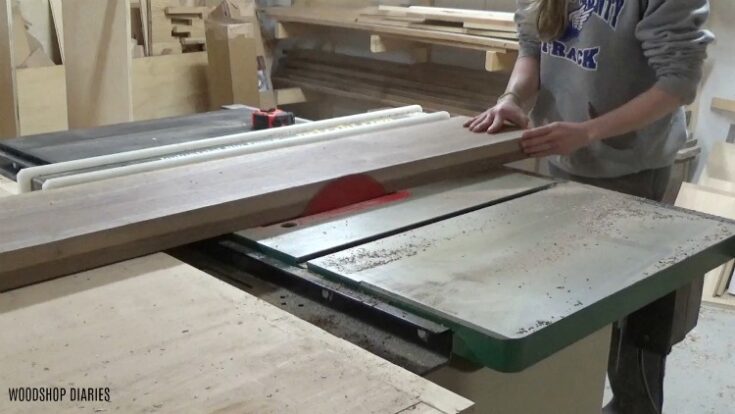
This screenshot has width=735, height=414. In order to click on wood plank in this screenshot , I will do `click(226, 183)`.